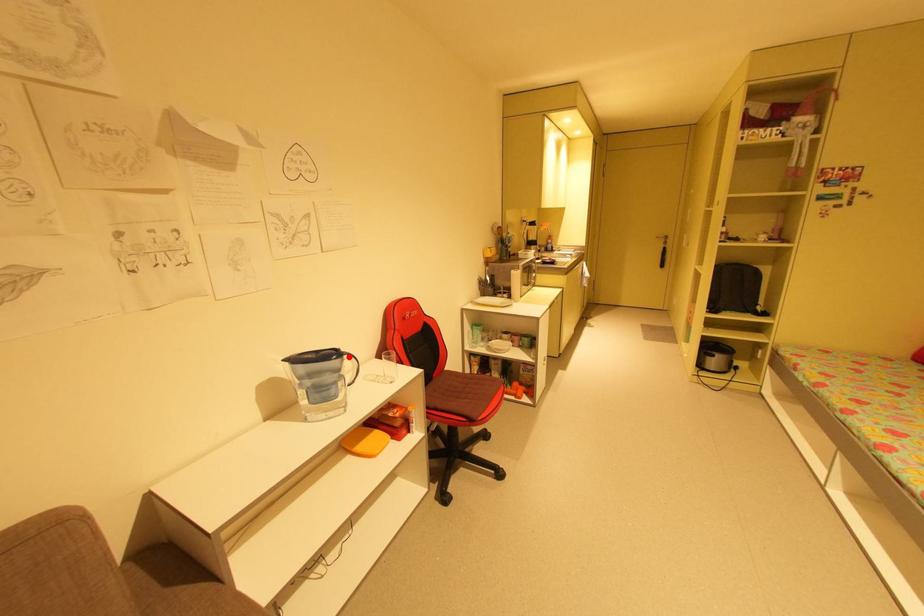
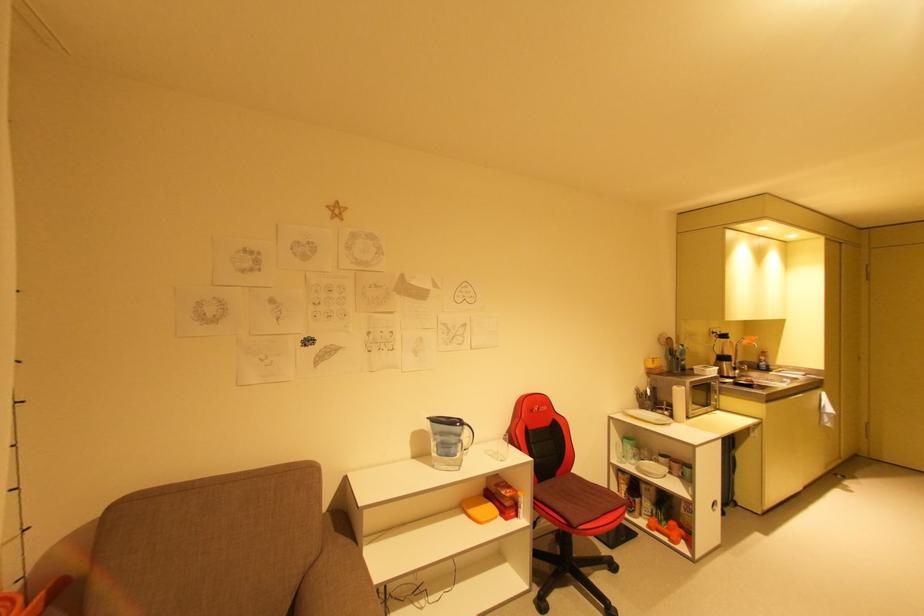
The point at the highlighted location is marked in the first image. Where is the corresponding point in the second image?

(469, 427)